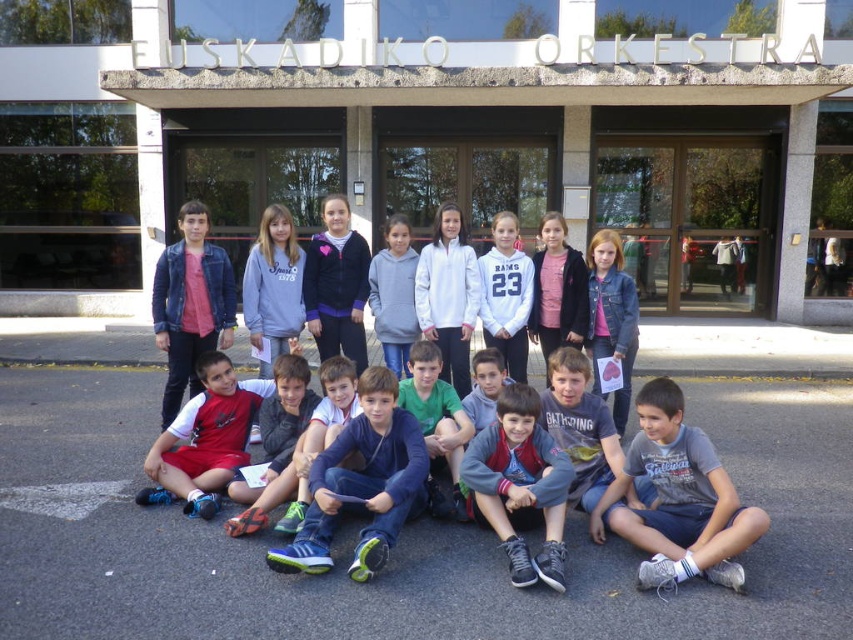
Question: Which object appears closest to the camera in this image?

Choices:
 (A) denim jacket at center
 (B) matte pink shirt at center

Answer: (B)

Question: Among these points, which one is nearest to the camera?

Choices:
 (A) (334, 481)
 (B) (450, 381)
 (C) (531, 564)
 (D) (527, 320)

Answer: (C)

Question: Does blue denim jeans at center appear on the left side of dark blue denim jacket at center?

Choices:
 (A) no
 (B) yes

Answer: (B)

Question: Does gray cotton shirt at lower right have a greater width compared to matte pink shirt at center?

Choices:
 (A) yes
 (B) no

Answer: (A)

Question: Does dark blue denim jacket at center appear over gray fleece sweatshirt at center?

Choices:
 (A) yes
 (B) no

Answer: (B)

Question: Which object appears farthest from the camera in this image?

Choices:
 (A) matte gray hoodie at center
 (B) gray fleece sweatshirt at center
 (C) matte pink shirt at center

Answer: (B)